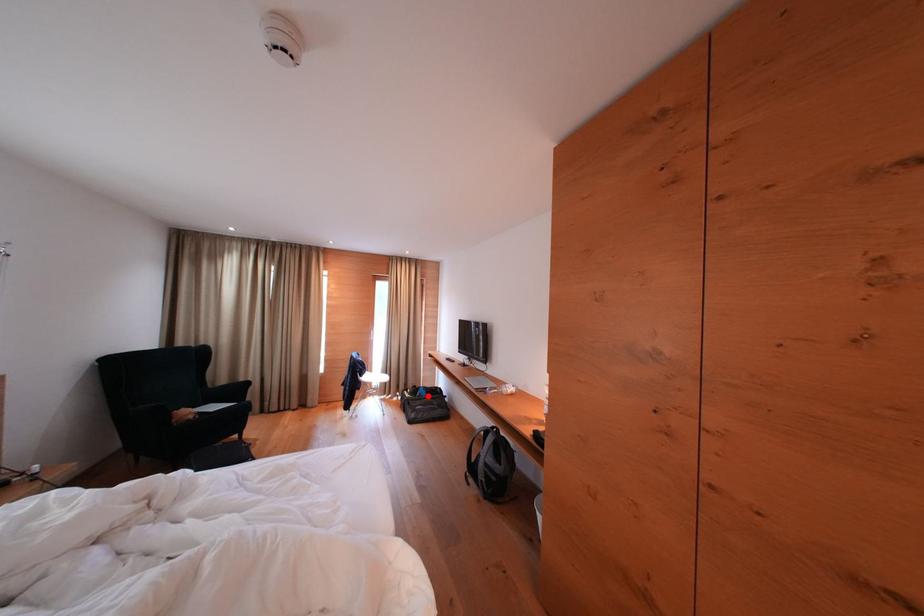
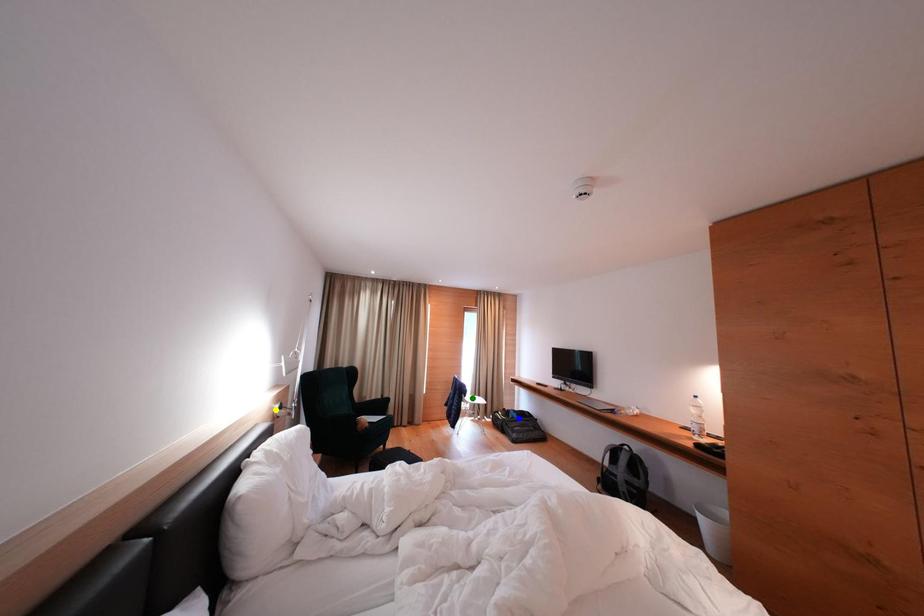
Question: I am providing you with two images of the same scene from different viewpoints. A red point is marked on the first image. You are given multiple points on the second image. Which point in image 2 represents the same 3d spot as the red point in image 1?

Choices:
 (A) green point
 (B) yellow point
 (C) blue point

Answer: (C)